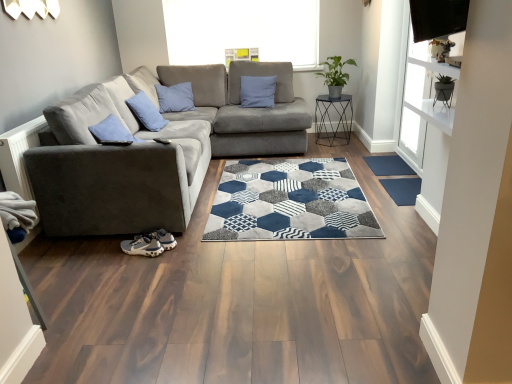
Question: Is velvet grey couch at center far from dark blue rubber mat at lower right, placed as the 2th doormat when sorted from bottom to top?

Choices:
 (A) yes
 (B) no

Answer: (A)

Question: Is the position of velvet grey couch at center less distant than that of dark blue rubber mat at lower right, the 1th doormat viewed from the top?

Choices:
 (A) no
 (B) yes

Answer: (A)

Question: Is velvet grey couch at center to the right of dark blue rubber mat at lower right, placed as the 2th doormat when sorted from bottom to top, from the viewer's perspective?

Choices:
 (A) yes
 (B) no

Answer: (B)

Question: Is velvet grey couch at center shorter than dark blue rubber mat at lower right, which ranks as the 2th doormat in front-to-back order?

Choices:
 (A) no
 (B) yes

Answer: (A)

Question: Is the depth of velvet grey couch at center greater than that of dark blue rubber mat at lower right, the 1th doormat viewed from the top?

Choices:
 (A) no
 (B) yes

Answer: (B)

Question: Is gray suede sneaker at lower left spatially inside metallic black side table at center, or outside of it?

Choices:
 (A) outside
 (B) inside

Answer: (A)

Question: Based on their positions, is gray suede sneaker at lower left located to the left or right of metallic black side table at center?

Choices:
 (A) right
 (B) left

Answer: (B)

Question: In terms of size, does gray suede sneaker at lower left appear bigger or smaller than metallic black side table at center?

Choices:
 (A) small
 (B) big

Answer: (A)

Question: From a real-world perspective, is gray suede sneaker at lower left physically located above or below metallic black side table at center?

Choices:
 (A) below
 (B) above

Answer: (A)

Question: From the image's perspective, relative to gray suede sneaker at lower left, is velvet grey couch at center above or below?

Choices:
 (A) above
 (B) below

Answer: (A)

Question: Considering their positions, is velvet grey couch at center located in front of or behind gray suede sneaker at lower left?

Choices:
 (A) front
 (B) behind

Answer: (B)

Question: Is point (183, 77) closer or farther from the camera than point (153, 238)?

Choices:
 (A) closer
 (B) farther

Answer: (B)

Question: Is velvet grey couch at center to the left or to the right of gray suede sneaker at lower left in the image?

Choices:
 (A) right
 (B) left

Answer: (A)

Question: From the image's perspective, relative to gray suede sneaker at lower left, is dark blue rubber mat at lower right, placed as the 2th doormat when sorted from bottom to top, above or below?

Choices:
 (A) above
 (B) below

Answer: (A)

Question: Considering the positions of dark blue rubber mat at lower right, placed as the 2th doormat when sorted from bottom to top, and gray suede sneaker at lower left in the image, is dark blue rubber mat at lower right, placed as the 2th doormat when sorted from bottom to top, taller or shorter than gray suede sneaker at lower left?

Choices:
 (A) tall
 (B) short

Answer: (B)